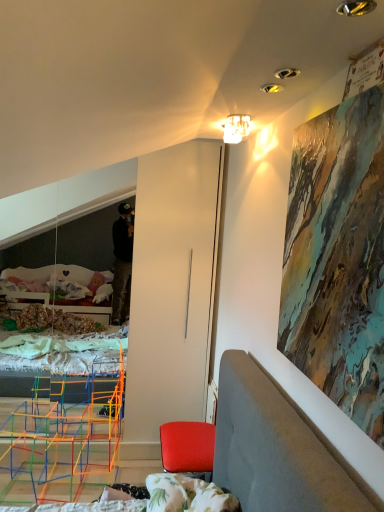
Question: Is red leather chair at lower right at the right side of matte glass chandelier at upper center?

Choices:
 (A) yes
 (B) no

Answer: (B)

Question: Considering the relative sizes of red leather chair at lower right and matte glass chandelier at upper center in the image provided, is red leather chair at lower right wider than matte glass chandelier at upper center?

Choices:
 (A) no
 (B) yes

Answer: (B)

Question: Can you confirm if red leather chair at lower right is shorter than matte glass chandelier at upper center?

Choices:
 (A) yes
 (B) no

Answer: (B)

Question: Would you say red leather chair at lower right is outside matte glass chandelier at upper center?

Choices:
 (A) yes
 (B) no

Answer: (A)

Question: Is red leather chair at lower right in front of matte glass chandelier at upper center?

Choices:
 (A) yes
 (B) no

Answer: (B)

Question: Considering the relative positions of red leather chair at lower right and matte glass chandelier at upper center in the image provided, is red leather chair at lower right to the left of matte glass chandelier at upper center from the viewer's perspective?

Choices:
 (A) no
 (B) yes

Answer: (B)

Question: From a real-world perspective, is matte glass chandelier at upper center positioned over red leather chair at lower right based on gravity?

Choices:
 (A) yes
 (B) no

Answer: (A)

Question: Are matte glass chandelier at upper center and red leather chair at lower right beside each other?

Choices:
 (A) no
 (B) yes

Answer: (A)

Question: Is matte glass chandelier at upper center taller than red leather chair at lower right?

Choices:
 (A) no
 (B) yes

Answer: (A)

Question: Does matte glass chandelier at upper center appear on the left side of red leather chair at lower right?

Choices:
 (A) yes
 (B) no

Answer: (B)

Question: Is red leather chair at lower right at the back of matte glass chandelier at upper center?

Choices:
 (A) yes
 (B) no

Answer: (B)

Question: From a real-world perspective, is matte glass chandelier at upper center below red leather chair at lower right?

Choices:
 (A) yes
 (B) no

Answer: (B)

Question: Is red leather chair at lower right inside or outside of matte glass chandelier at upper center?

Choices:
 (A) outside
 (B) inside

Answer: (A)